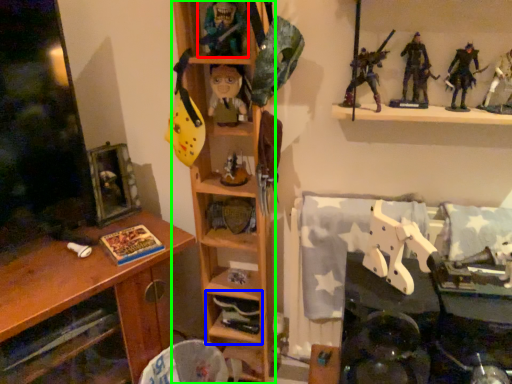
Question: Estimate the real-world distances between objects in this image. Which object is farther from toy (highlighted by a red box), shelf (highlighted by a blue box) or shelf (highlighted by a green box)?

Choices:
 (A) shelf
 (B) shelf

Answer: (A)